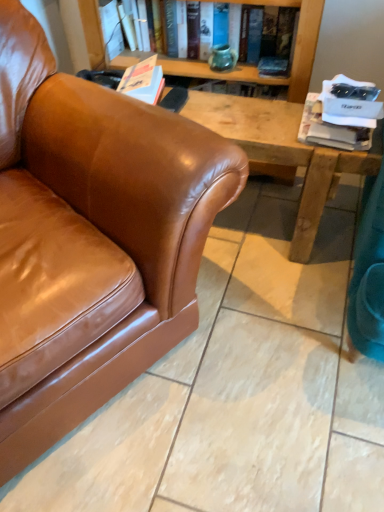
Question: Relative to white paper at upper right, which is counted as the first book, starting from the bottom, is brown leather couch at left in front or behind?

Choices:
 (A) front
 (B) behind

Answer: (A)

Question: Considering the positions of brown leather couch at left and white paper at upper right, placed as the 2th book when sorted from top to bottom, in the image, is brown leather couch at left bigger or smaller than white paper at upper right, placed as the 2th book when sorted from top to bottom,?

Choices:
 (A) big
 (B) small

Answer: (A)

Question: Which object is positioned closest to the white paper at upper right, which is counted as the first book, starting from the bottom?

Choices:
 (A) brown leather couch at left
 (B) matte green vase at upper center, the second book positioned from the right

Answer: (B)

Question: Estimate the real-world distances between objects in this image. Which object is farther from the white paper at upper right, placed as the 2th book when sorted from top to bottom?

Choices:
 (A) matte green vase at upper center, the 1th book viewed from the top
 (B) brown leather couch at left

Answer: (B)